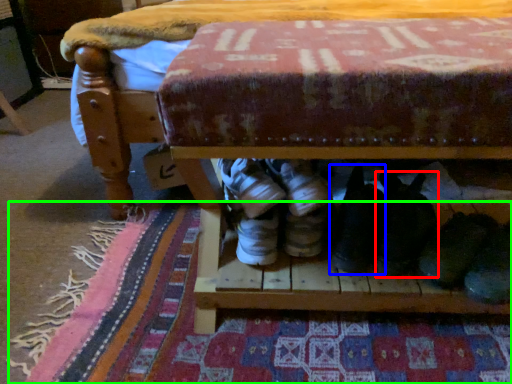
Question: Which object is the closest to the footwear (highlighted by a red box)? Choose among these: footwear (highlighted by a blue box) or mat (highlighted by a green box).

Choices:
 (A) footwear
 (B) mat

Answer: (A)